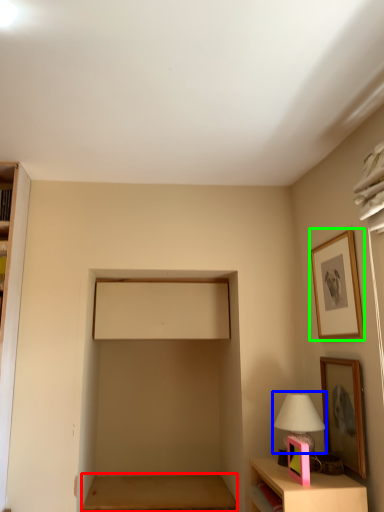
Question: Which object is positioned closest to table (highlighted by a red box)? Select from table lamp (highlighted by a blue box) and picture frame (highlighted by a green box).

Choices:
 (A) table lamp
 (B) picture frame

Answer: (A)